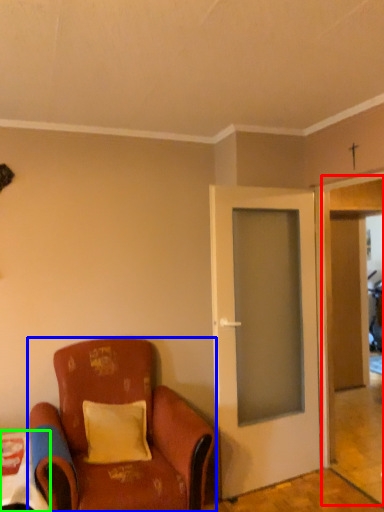
Question: Which object is the closest to the garage door (highlighted by a red box)? Choose among these: chair (highlighted by a blue box) or table (highlighted by a green box).

Choices:
 (A) chair
 (B) table

Answer: (A)